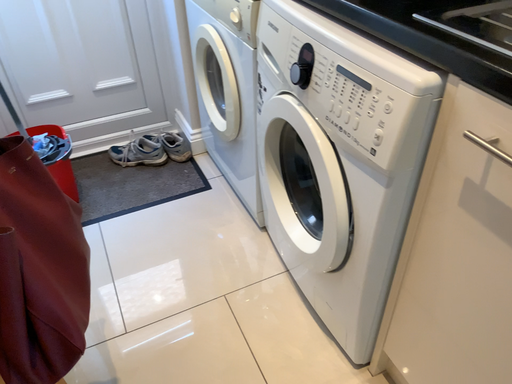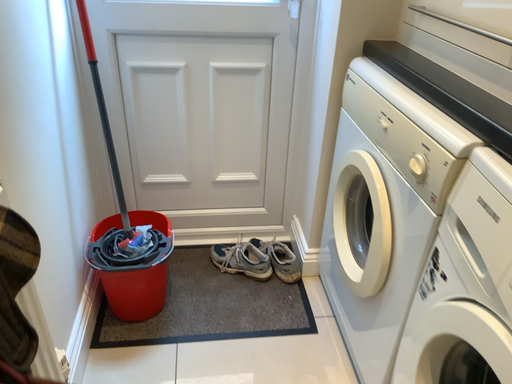
Question: Which way did the camera rotate in the video?

Choices:
 (A) rotated upward
 (B) rotated downward

Answer: (A)